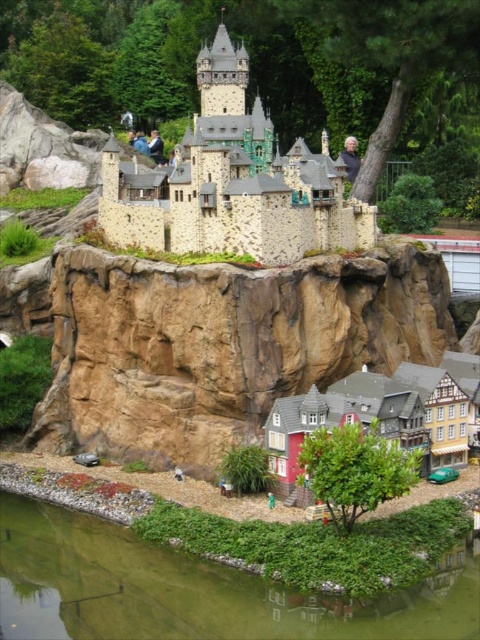
You are standing in front of the castle and want to walk down to the cliff. Which direction should you move relative to the stone brick castle at upper center to reach the brown rock cliff at lower center?

To reach the brown rock cliff at lower center from the stone brick castle at upper center, you should move to the right since the brown rock cliff at lower center is located to the right of the stone brick castle at upper center.

You are standing at the base of the cliff looking up at the castle. You notice a point marked on the image at coordinates (192, 589). What is located at this point?

The point at coordinates (192, 589) indicates green liquid water at lower center.

You are standing at the base of the cliff and want to reach the castle. You see the brown rock cliff at lower center and the green liquid water at lower center. Which direction should you move to avoid the water and head towards the cliff?

You should move to the right to avoid the green liquid water at lower center and head towards the brown rock cliff at lower center since the brown rock cliff at lower center is located to the right of the green liquid water at lower center.